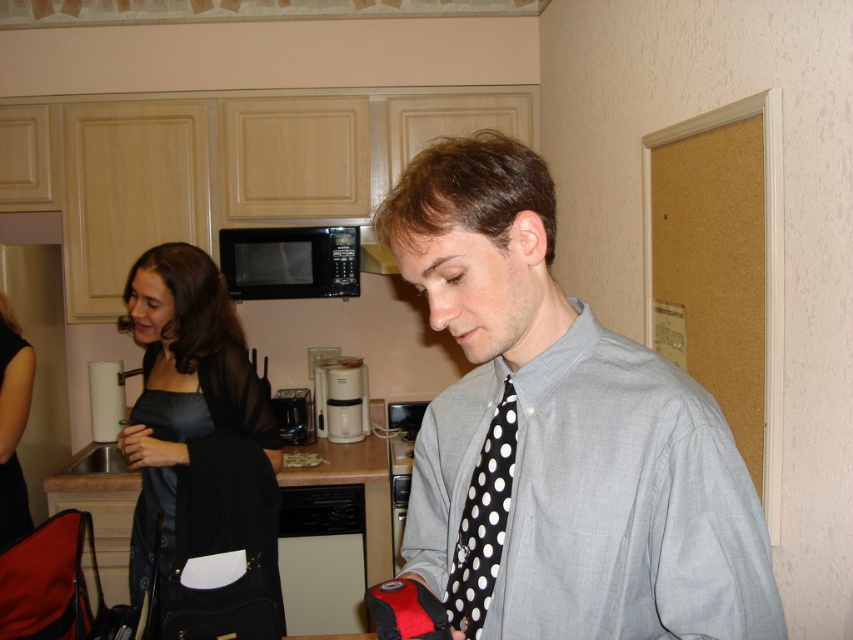
Question: Which object is the closest to the black satin dress at center?

Choices:
 (A) black dotted fabric tie at center
 (B) gray cotton shirt at center
 (C) white plastic coffee machine at center
 (D) black matte microwave at upper center

Answer: (D)

Question: Can you confirm if black satin dress at center is positioned above black matte microwave at upper center?

Choices:
 (A) yes
 (B) no

Answer: (B)

Question: Can you confirm if black satin dress at center is thinner than black matte microwave at upper center?

Choices:
 (A) yes
 (B) no

Answer: (B)

Question: Can you confirm if black satin dress at center is bigger than black matte microwave at upper center?

Choices:
 (A) yes
 (B) no

Answer: (A)

Question: Which of the following is the closest to the observer?

Choices:
 (A) black dotted fabric tie at center
 (B) black satin dress at center
 (C) gray cotton shirt at center
 (D) black matte microwave at upper center

Answer: (C)

Question: Which of these objects is positioned closest to the black satin dress at center?

Choices:
 (A) white plastic coffee machine at center
 (B) black matte microwave at upper center

Answer: (B)